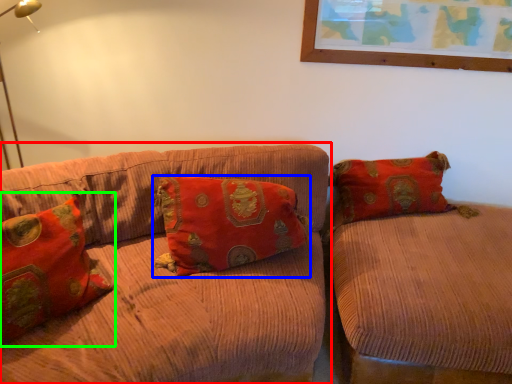
Question: Considering the real-world distances, which object is farthest from studio couch (highlighted by a red box)? pillow (highlighted by a blue box) or pillow (highlighted by a green box)?

Choices:
 (A) pillow
 (B) pillow

Answer: (B)